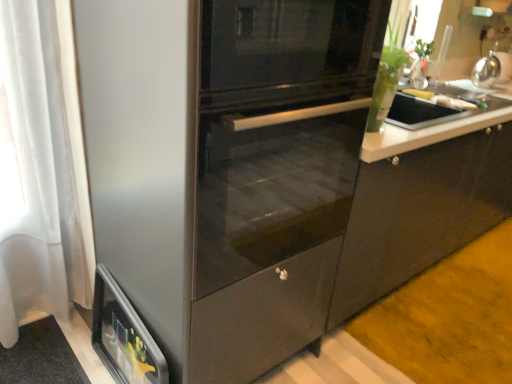
Where is `free space to the back side of white glossy plate at upper right, positioned as the 1th food in front-to-back order`? This screenshot has height=384, width=512. free space to the back side of white glossy plate at upper right, positioned as the 1th food in front-to-back order is located at coordinates (445, 93).